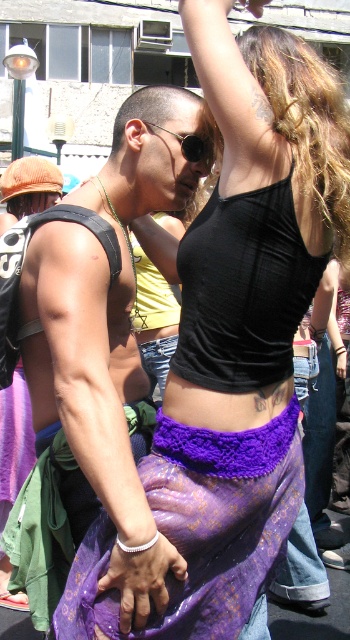
Question: Which point is farther from the camera taking this photo?

Choices:
 (A) (129, 579)
 (B) (30, 532)
 (C) (274, 236)

Answer: (C)

Question: Which of the following is the closest to the observer?

Choices:
 (A) black ribbed tank top at center
 (B) purple crochet belt at center
 (C) sunglasses at center

Answer: (B)

Question: Estimate the real-world distances between objects in this image. Which object is closer to the sunglasses at center?

Choices:
 (A) purple crochet belt at center
 (B) black ribbed tank top at center

Answer: (B)

Question: Does matte black tank top at upper center have a smaller size compared to purple crochet belt at center?

Choices:
 (A) no
 (B) yes

Answer: (A)

Question: Can you confirm if black ribbed tank top at center is thinner than purple crochet belt at center?

Choices:
 (A) yes
 (B) no

Answer: (B)

Question: Is matte black tank top at upper center above black ribbed tank top at center?

Choices:
 (A) no
 (B) yes

Answer: (A)